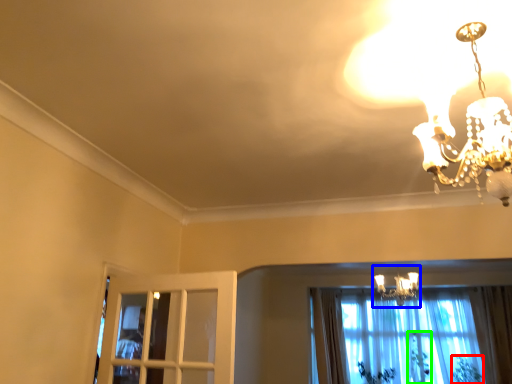
Question: Based on their relative distances, which object is farther from plant (highlighted by a red box)? Choose from lamp (highlighted by a blue box) and plant (highlighted by a green box).

Choices:
 (A) lamp
 (B) plant

Answer: (A)